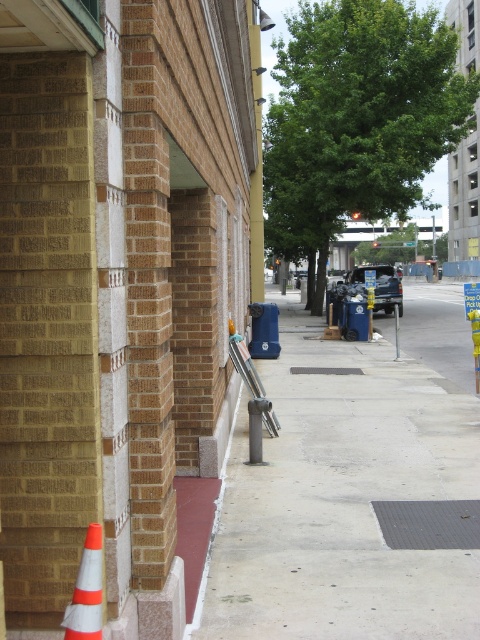
Which of these two, smooth concrete sidewalk at center or orange/white striped cone at lower left, stands taller?

smooth concrete sidewalk at center

Which is in front, point (216, 560) or point (85, 582)?

Point (85, 582) is in front.

This screenshot has height=640, width=480. Identify the location of smooth concrete sidewalk at center. (343, 499).

The height and width of the screenshot is (640, 480). I want to click on smooth concrete sidewalk at center, so click(x=343, y=499).

Who is positioned more to the right, smooth concrete sidewalk at center or red rubber curb at lower left?

From the viewer's perspective, smooth concrete sidewalk at center appears more on the right side.

You are a GUI agent. You are given a task and a screenshot of the screen. Output one action in this format:
    pyautogui.click(x=<x>, y=<y>)
    Task: Click on the smooth concrete sidewalk at center
    The image size is (480, 640).
    Given the screenshot: What is the action you would take?
    pyautogui.click(x=343, y=499)

This screenshot has width=480, height=640. Describe the element at coordinates (86, 592) in the screenshot. I see `orange/white striped cone at lower left` at that location.

Measure the distance from orange/white striped cone at lower left to red rubber curb at lower left.

A distance of 2.16 meters exists between orange/white striped cone at lower left and red rubber curb at lower left.

Who is more forward, (95, 580) or (223, 476)?

Positioned in front is point (95, 580).

Find the location of a particular element. Image resolution: width=480 pixels, height=640 pixels. orange/white striped cone at lower left is located at coordinates (86, 592).